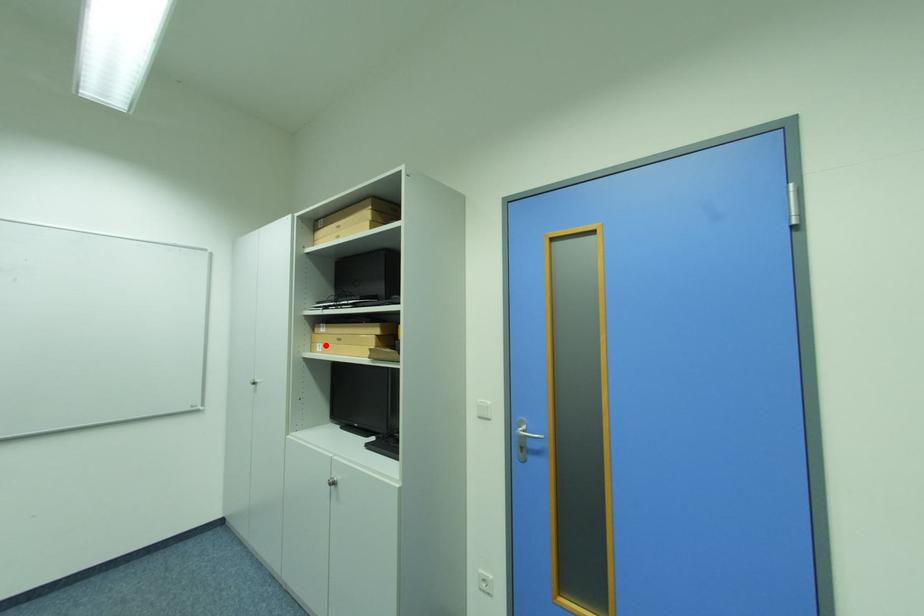
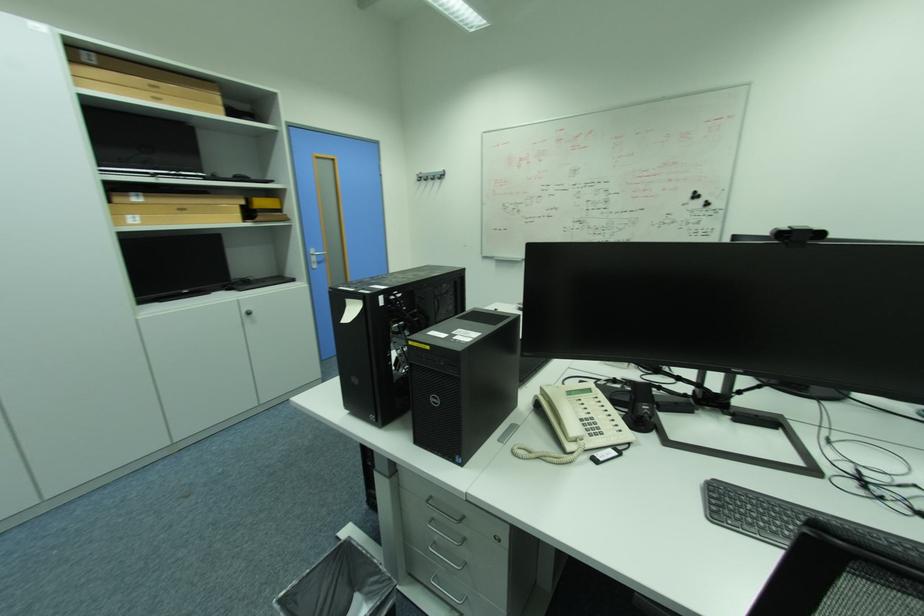
Question: I am providing you with two images of the same scene from different viewpoints. A red point is marked on the first image. At the location where the point appears in image 1, is it still visible in image 2?

Choices:
 (A) Yes
 (B) No

Answer: (A)